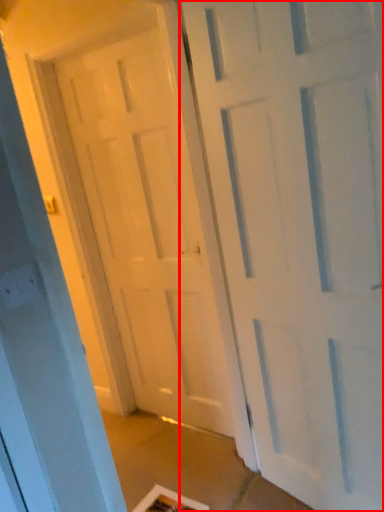
Question: From the image's perspective, where is door (annotated by the red box) located in relation to door in the image?

Choices:
 (A) below
 (B) above

Answer: (A)